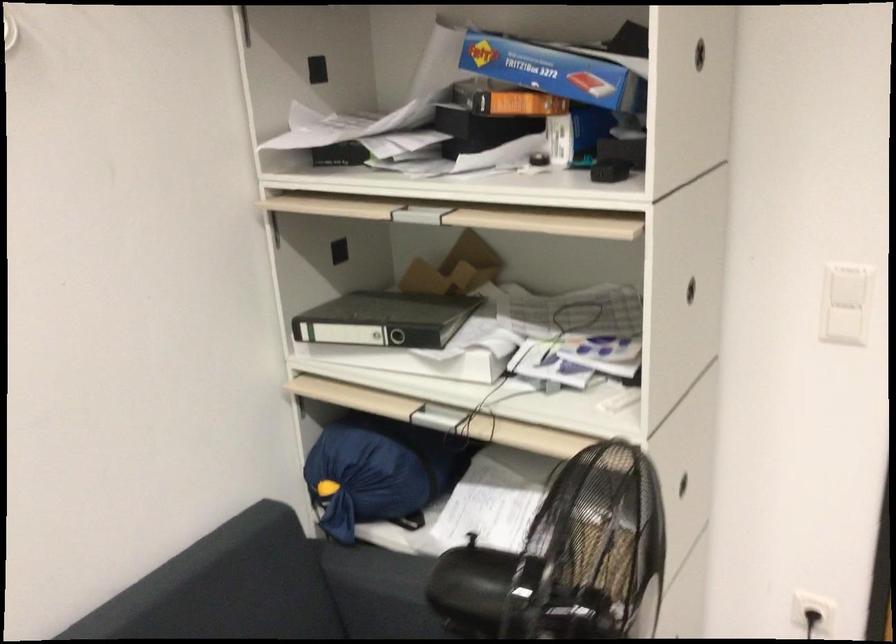
This screenshot has height=644, width=896. I want to click on blue cardboard box, so click(x=553, y=71).